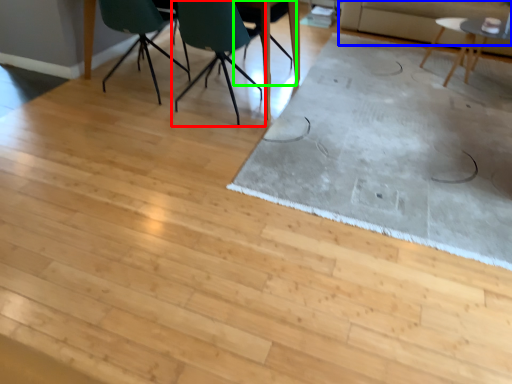
Question: Based on their relative distances, which object is farther from chair (highlighted by a red box)? Choose from couch (highlighted by a blue box) and chair (highlighted by a green box).

Choices:
 (A) couch
 (B) chair

Answer: (A)